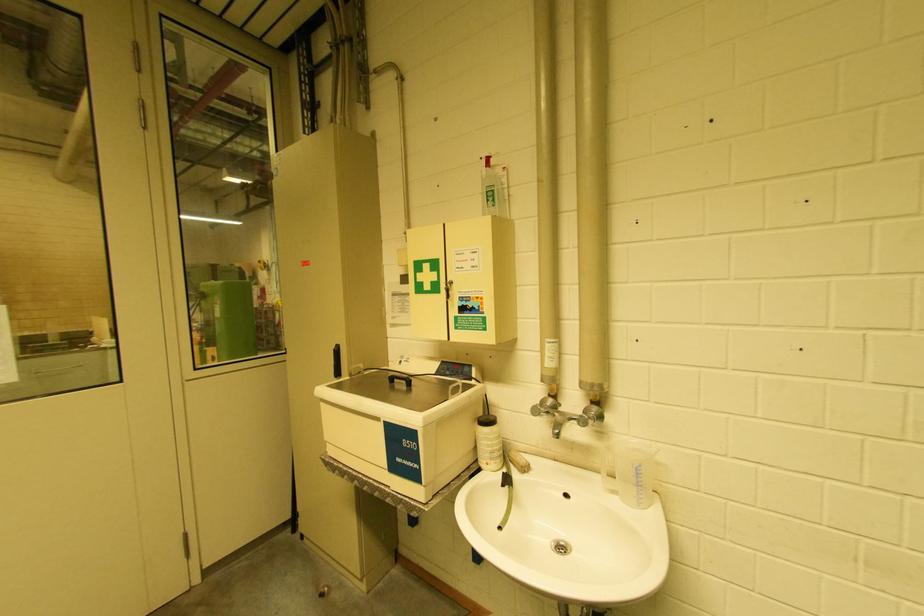
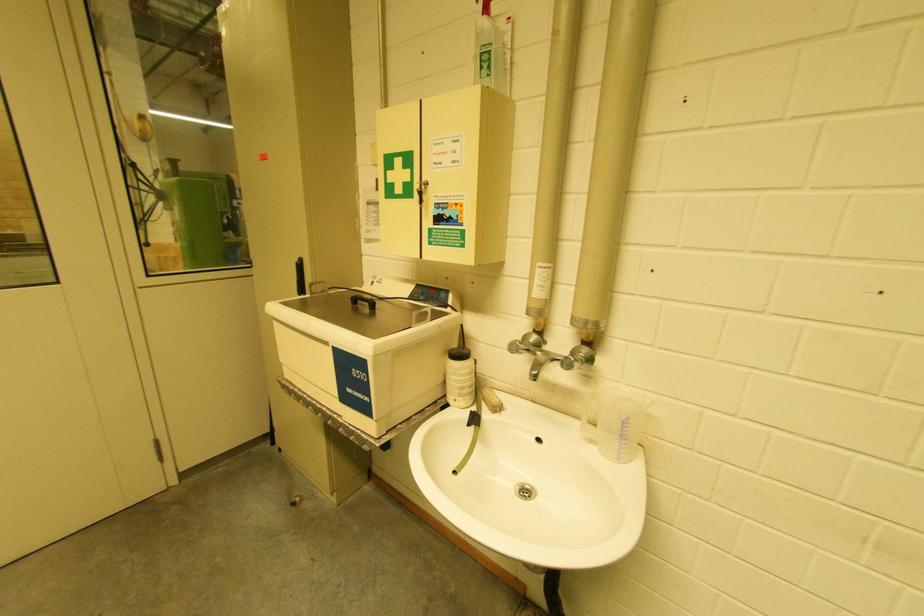
What movement of the cameraman would produce the second image?

The cameraman walked toward right, forward.